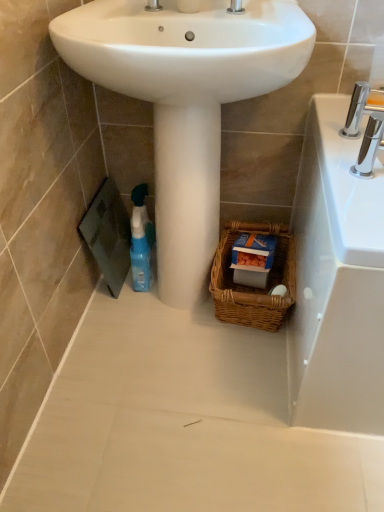
Question: Are woven brown basket at lower center and white glossy sink at center beside each other?

Choices:
 (A) no
 (B) yes

Answer: (A)

Question: Does woven brown basket at lower center come in front of white glossy sink at center?

Choices:
 (A) no
 (B) yes

Answer: (A)

Question: From a real-world perspective, is woven brown basket at lower center positioned under white glossy sink at center based on gravity?

Choices:
 (A) no
 (B) yes

Answer: (B)

Question: Does woven brown basket at lower center have a lesser width compared to white glossy sink at center?

Choices:
 (A) yes
 (B) no

Answer: (A)

Question: Is woven brown basket at lower center looking in the opposite direction of white glossy sink at center?

Choices:
 (A) no
 (B) yes

Answer: (A)

Question: Do you think woven brown basket at lower center is within blue plastic spray bottle at lower left, or outside of it?

Choices:
 (A) outside
 (B) inside

Answer: (A)

Question: Considering their positions, is woven brown basket at lower center located in front of or behind blue plastic spray bottle at lower left?

Choices:
 (A) behind
 (B) front

Answer: (B)

Question: Does point (274, 268) appear closer or farther from the camera than point (137, 248)?

Choices:
 (A) closer
 (B) farther

Answer: (B)

Question: Is woven brown basket at lower center taller or shorter than blue plastic spray bottle at lower left?

Choices:
 (A) short
 (B) tall

Answer: (A)

Question: From a real-world perspective, is chrome metallic faucet at upper right above or below white smooth pedestal at center?

Choices:
 (A) below
 (B) above

Answer: (B)

Question: From the image's perspective, is chrome metallic faucet at upper right located above or below white smooth pedestal at center?

Choices:
 (A) above
 (B) below

Answer: (A)

Question: Considering the positions of point (367, 148) and point (210, 163), is point (367, 148) closer or farther from the camera than point (210, 163)?

Choices:
 (A) farther
 (B) closer

Answer: (B)

Question: Is chrome metallic faucet at upper right taller or shorter than white smooth pedestal at center?

Choices:
 (A) short
 (B) tall

Answer: (A)

Question: From the image's perspective, is blue plastic spray bottle at lower left located above or below white smooth pedestal at center?

Choices:
 (A) below
 (B) above

Answer: (A)

Question: Does point (132, 219) appear closer or farther from the camera than point (173, 270)?

Choices:
 (A) farther
 (B) closer

Answer: (A)